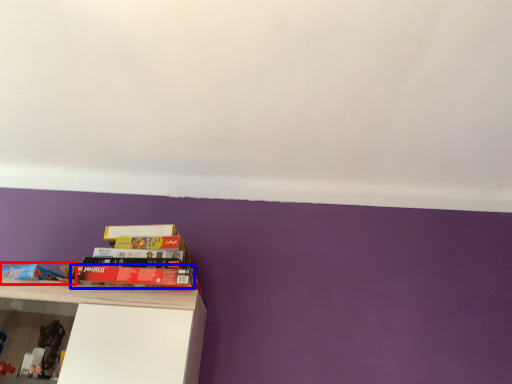
Question: Which object appears farthest to the camera in this image, book (highlighted by a red box) or book (highlighted by a blue box)?

Choices:
 (A) book
 (B) book

Answer: (B)